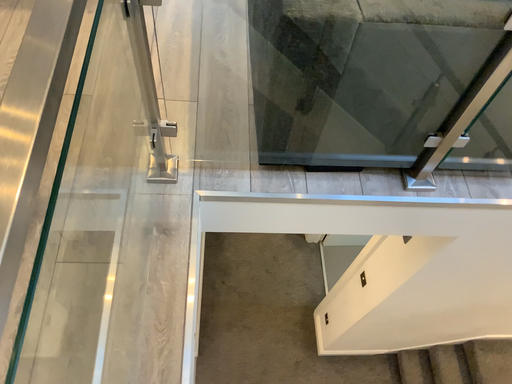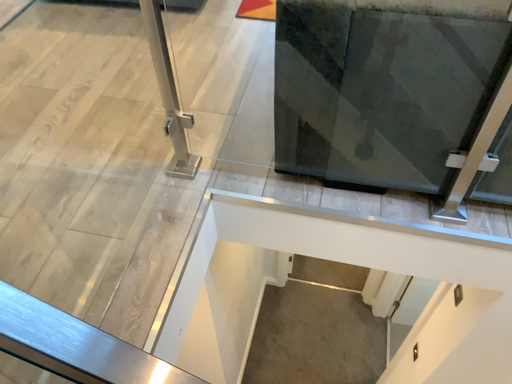
Question: Which way did the camera rotate in the video?

Choices:
 (A) rotated upward
 (B) rotated downward

Answer: (A)